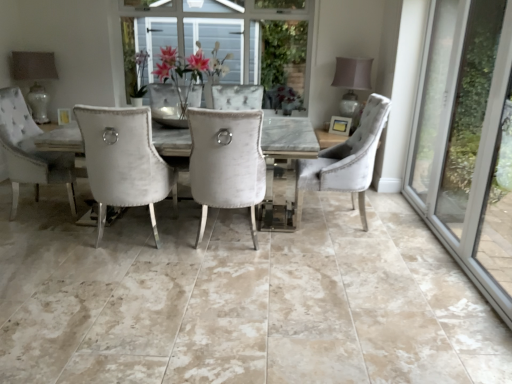
Find the location of a particular element. The height and width of the screenshot is (384, 512). vacant region in front of velvet white chair at center, which ranks as the first chair in left-to-right order is located at coordinates (220, 274).